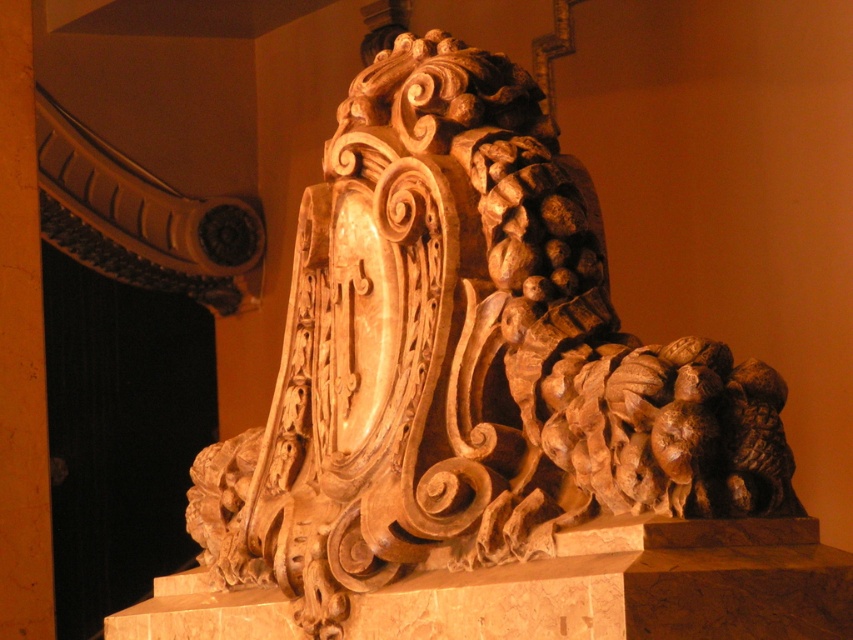
Question: Does wooden carving at center have a lesser width compared to orange polished wood at upper left?

Choices:
 (A) no
 (B) yes

Answer: (A)

Question: Is wooden carving at center wider than orange polished wood at upper left?

Choices:
 (A) yes
 (B) no

Answer: (A)

Question: Can you confirm if wooden carving at center is positioned to the left of orange polished wood at upper left?

Choices:
 (A) yes
 (B) no

Answer: (B)

Question: Which object appears closest to the camera in this image?

Choices:
 (A) orange polished wood at upper left
 (B) wooden carving at center

Answer: (B)

Question: Which object appears farthest from the camera in this image?

Choices:
 (A) wooden carving at center
 (B) orange polished wood at upper left

Answer: (B)

Question: Which point is farther from the camera taking this photo?

Choices:
 (A) (378, 136)
 (B) (24, 285)

Answer: (B)